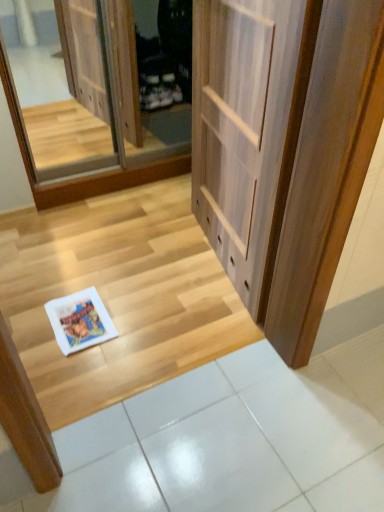
In order to click on free spot below white paper magazine at lower left (from a real-world perspective) in this screenshot , I will do `click(83, 323)`.